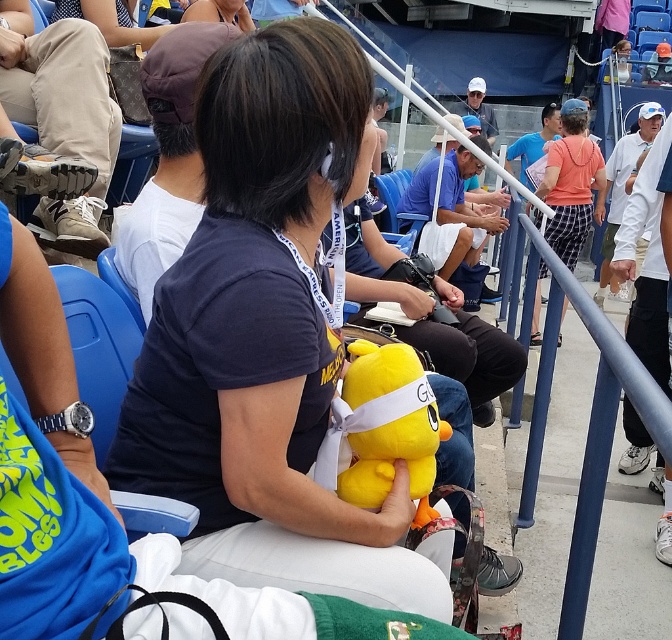
You are a photographer positioned at the center of the scene. You want to take a photo that includes both the yellow plush toy at center and the orange cotton shirt at center. What is the minimum distance you need to move to ensure both are in frame?

The minimum distance you need to move is 4.18 meters to ensure both the yellow plush toy at center and the orange cotton shirt at center are in frame since they are 4.18 meters apart.